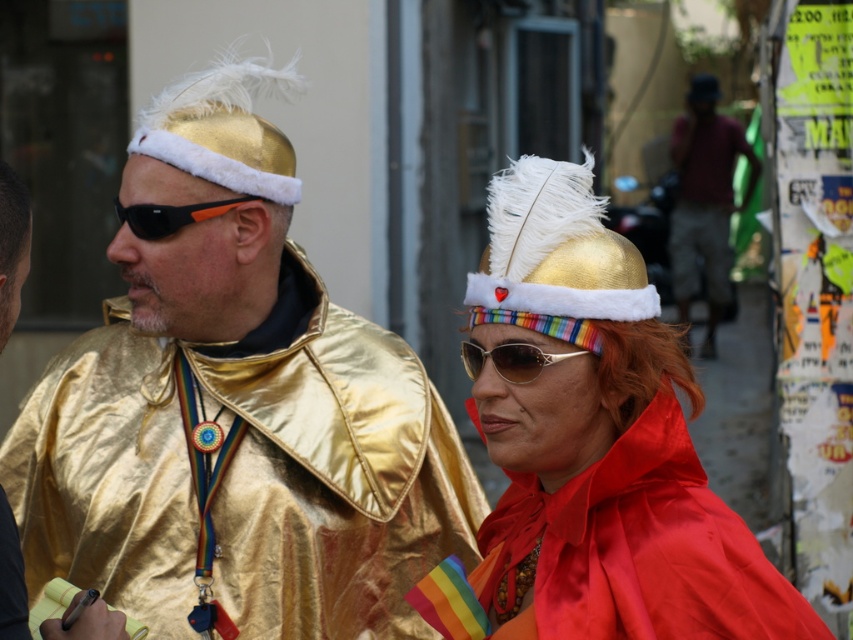
You are organizing a costume parade and need to arrange the two metallic gold capes from largest to smallest. Given that you can only see the metallic gold cape at left and the metallic gold cape at center in the image, which one should come first?

The metallic gold cape at left should come first because it is bigger than the metallic gold cape at center.

You are a photographer at the event and want to capture a photo where both the metallic gold cape at left and the shiny gold sunglasses at center are visible. Based on their positions, which object should you ensure is in the foreground to include both?

The metallic gold cape at left is below the shiny gold sunglasses at center, so to ensure both are visible, the sunglasses should be in the foreground since the cape is positioned lower.

You are trying to decide which item to take with you for a quick escape. The metallic gold cape at left is bulky, while the shiny gold sunglasses at center are lightweight. Based on their sizes, which one is easier to carry?

The shiny gold sunglasses at center are easier to carry because they are smaller and lighter compared to the metallic gold cape at left.